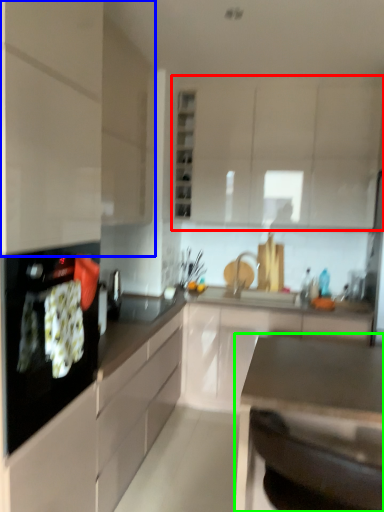
Question: Which object is positioned closest to cabinetry (highlighted by a red box)? Select from cabinetry (highlighted by a blue box) and countertop (highlighted by a green box).

Choices:
 (A) cabinetry
 (B) countertop

Answer: (A)